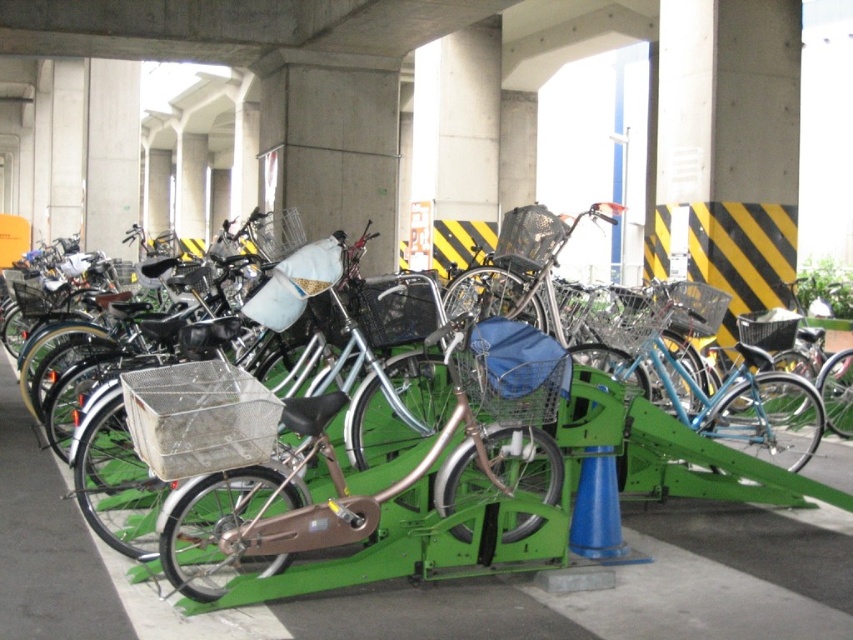
Identify the location of metallic silver bicycle at center. Image resolution: width=853 pixels, height=640 pixels. (393, 483).

Who is higher up, metallic silver bicycle at center or silver metallic bicycle at center?

silver metallic bicycle at center is higher up.

I want to click on metallic silver bicycle at center, so click(393, 483).

Image resolution: width=853 pixels, height=640 pixels. Find the location of `metallic silver bicycle at center`. metallic silver bicycle at center is located at coordinates (393, 483).